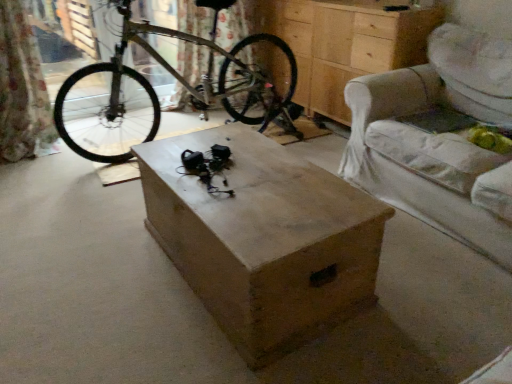
Question: Is light beige fabric armchair at right wider than wooden chest of drawers at center?

Choices:
 (A) yes
 (B) no

Answer: (A)

Question: From the image's perspective, is light beige fabric armchair at right over wooden chest of drawers at center?

Choices:
 (A) no
 (B) yes

Answer: (A)

Question: From the image's perspective, would you say light beige fabric armchair at right is shown under wooden chest of drawers at center?

Choices:
 (A) yes
 (B) no

Answer: (A)

Question: Is light beige fabric armchair at right looking in the opposite direction of wooden chest of drawers at center?

Choices:
 (A) no
 (B) yes

Answer: (A)

Question: Considering the relative sizes of light beige fabric armchair at right and wooden chest of drawers at center in the image provided, is light beige fabric armchair at right bigger than wooden chest of drawers at center?

Choices:
 (A) yes
 (B) no

Answer: (A)

Question: Is wooden chest of drawers at center surrounded by light beige fabric armchair at right?

Choices:
 (A) yes
 (B) no

Answer: (B)

Question: Is silver metallic bicycle at center outside of wooden chest of drawers at center?

Choices:
 (A) yes
 (B) no

Answer: (A)

Question: Considering the relative positions of silver metallic bicycle at center and wooden chest of drawers at center in the image provided, is silver metallic bicycle at center to the right of wooden chest of drawers at center from the viewer's perspective?

Choices:
 (A) no
 (B) yes

Answer: (A)

Question: Can you confirm if silver metallic bicycle at center is smaller than wooden chest of drawers at center?

Choices:
 (A) yes
 (B) no

Answer: (B)

Question: Does silver metallic bicycle at center have a larger size compared to wooden chest of drawers at center?

Choices:
 (A) yes
 (B) no

Answer: (A)

Question: Is silver metallic bicycle at center with wooden chest of drawers at center?

Choices:
 (A) no
 (B) yes

Answer: (A)

Question: Does silver metallic bicycle at center have a greater height compared to wooden chest of drawers at center?

Choices:
 (A) yes
 (B) no

Answer: (A)

Question: Does light beige fabric armchair at right have a larger size compared to wooden box at center?

Choices:
 (A) yes
 (B) no

Answer: (A)